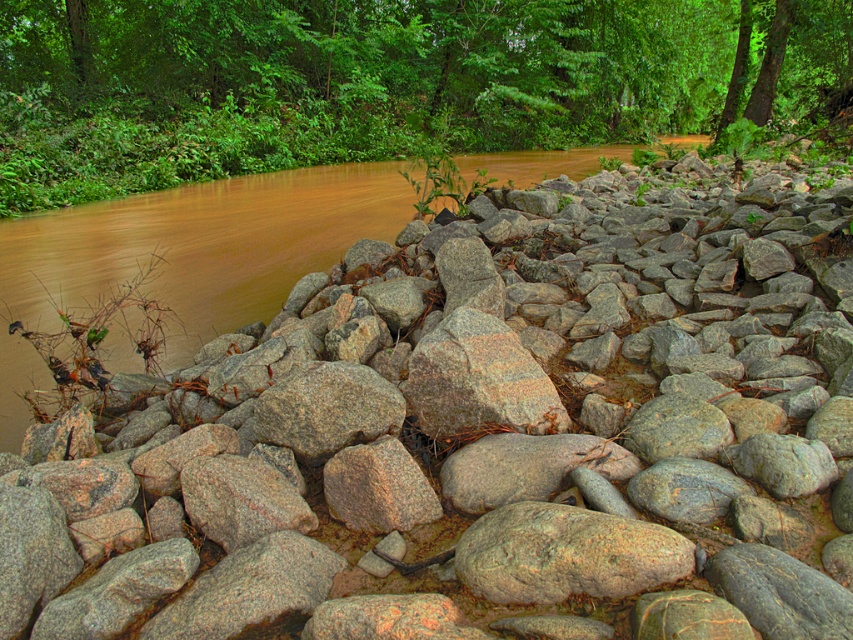
Question: Can you confirm if green leafy tree at upper center is positioned below granite rock at center?

Choices:
 (A) no
 (B) yes

Answer: (A)

Question: Is green leafy tree at upper center to the right of granite rock at center from the viewer's perspective?

Choices:
 (A) yes
 (B) no

Answer: (A)

Question: Can you confirm if green leafy tree at upper center is positioned below granite rock at center?

Choices:
 (A) no
 (B) yes

Answer: (A)

Question: Which object is farther from the camera taking this photo?

Choices:
 (A) granite rock at center
 (B) green leafy tree at upper center

Answer: (B)